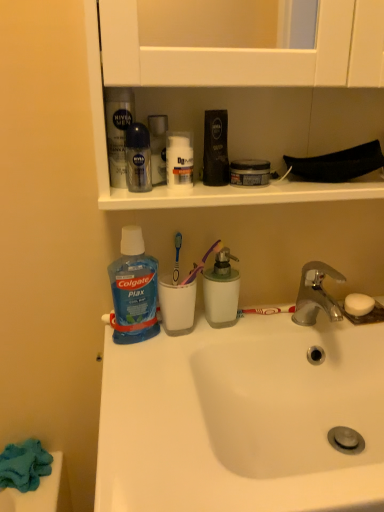
You are a GUI agent. You are given a task and a screenshot of the screen. Output one action in this format:
    pyautogui.click(x=<x>, y=<y>)
    Task: Click on the free space in front of blue plastic toothbrush at center, which is the 1th toothbrush from left to right
    
    Given the screenshot: What is the action you would take?
    pyautogui.click(x=157, y=350)